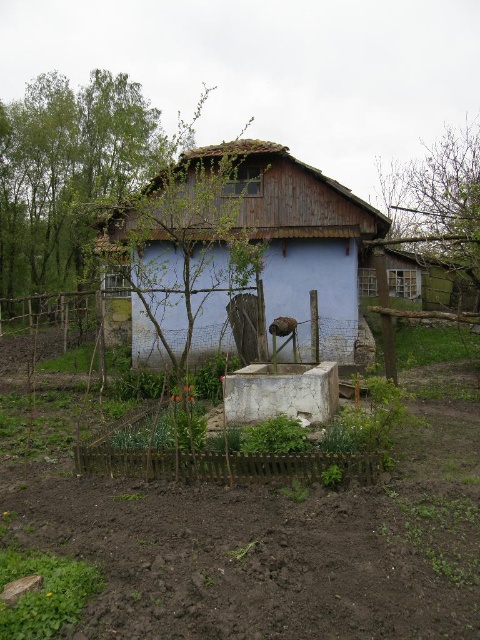
Question: Which point is closer to the camera taking this photo?

Choices:
 (A) (245, 468)
 (B) (346, 595)

Answer: (B)

Question: Is the position of brown soil at center less distant than that of wooden hut at center?

Choices:
 (A) no
 (B) yes

Answer: (B)

Question: Is brown soil at center bigger than brown wooden fence at lower center?

Choices:
 (A) yes
 (B) no

Answer: (B)

Question: Estimate the real-world distances between objects in this image. Which object is farther from the wooden hut at center?

Choices:
 (A) brown soil at center
 (B) brown wooden fence at lower center

Answer: (A)

Question: Is wooden hut at center below brown wooden fence at lower center?

Choices:
 (A) yes
 (B) no

Answer: (B)

Question: Which point is closer to the camera?

Choices:
 (A) brown wooden fence at lower center
 (B) brown soil at center
 (C) wooden hut at center

Answer: (B)